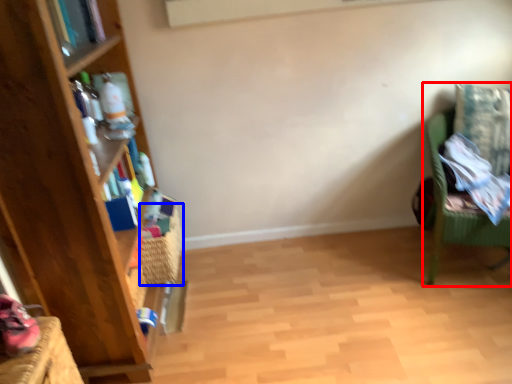
Question: Among these objects, which one is farthest to the camera, chair (highlighted by a red box) or basket (highlighted by a blue box)?

Choices:
 (A) chair
 (B) basket

Answer: (B)